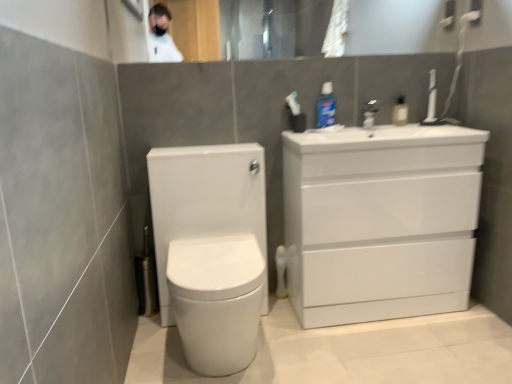
Question: Visually, is clear plastic bottle at upper center, the 2th toiletry in the left-to-right sequence, positioned to the left or to the right of white glossy toilet at center?

Choices:
 (A) right
 (B) left

Answer: (A)

Question: From their relative heights in the image, would you say clear plastic bottle at upper center, which is the 1th toiletry in right-to-left order, is taller or shorter than white glossy toilet at center?

Choices:
 (A) tall
 (B) short

Answer: (B)

Question: Which object is positioned closest to the clear plastic bottle at upper center, the 2th toiletry in the left-to-right sequence?

Choices:
 (A) white glossy toilet at center
 (B) white glossy cabinet at right
 (C) blue glossy mouthwash at upper center, the 1th toiletry when ordered from left to right
 (D) satin nickel faucet at upper center
 (E) glossy glass mirror at upper center

Answer: (D)

Question: Estimate the real-world distances between objects in this image. Which object is closer to the satin nickel faucet at upper center?

Choices:
 (A) clear plastic bottle at upper center, which is the 1th toiletry in right-to-left order
 (B) glossy glass mirror at upper center
 (C) white glossy toilet at center
 (D) blue glossy mouthwash at upper center, which is the second toiletry from right to left
 (E) white glossy cabinet at right

Answer: (A)